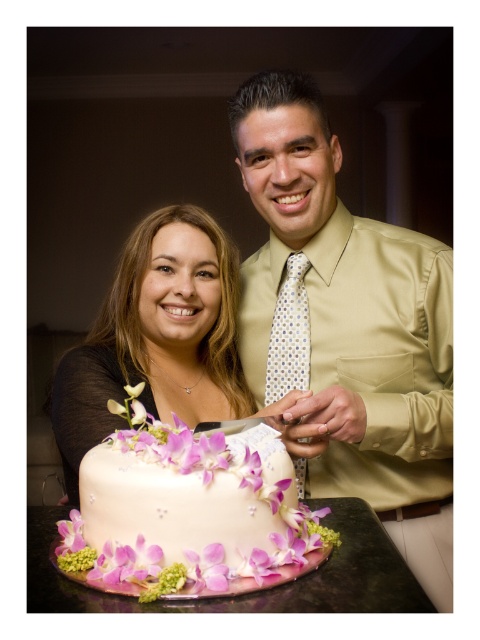
Between matte gold shirt at center and smooth cream cake at center, which one appears on the left side from the viewer's perspective?

From the viewer's perspective, smooth cream cake at center appears more on the left side.

Who is positioned more to the right, matte gold shirt at center or smooth cream cake at center?

Positioned to the right is matte gold shirt at center.

Locate an element on the screen. The image size is (480, 640). matte gold shirt at center is located at coordinates (348, 326).

Is point (307, 371) in front of point (124, 412)?

That is False.

Which of these two, matte gold shirt at center or white fondant cake with floral decorations at center, stands shorter?

Standing shorter between the two is white fondant cake with floral decorations at center.

Image resolution: width=480 pixels, height=640 pixels. I want to click on matte gold shirt at center, so click(348, 326).

I want to click on matte gold shirt at center, so click(348, 326).

Is white fondant cake with floral decorations at center to the left of smooth cream cake at center from the viewer's perspective?

In fact, white fondant cake with floral decorations at center is to the right of smooth cream cake at center.

Where is `white fondant cake with floral decorations at center`? The height and width of the screenshot is (640, 480). white fondant cake with floral decorations at center is located at coordinates (188, 509).

Where is `white fondant cake with floral decorations at center`? white fondant cake with floral decorations at center is located at coordinates (188, 509).